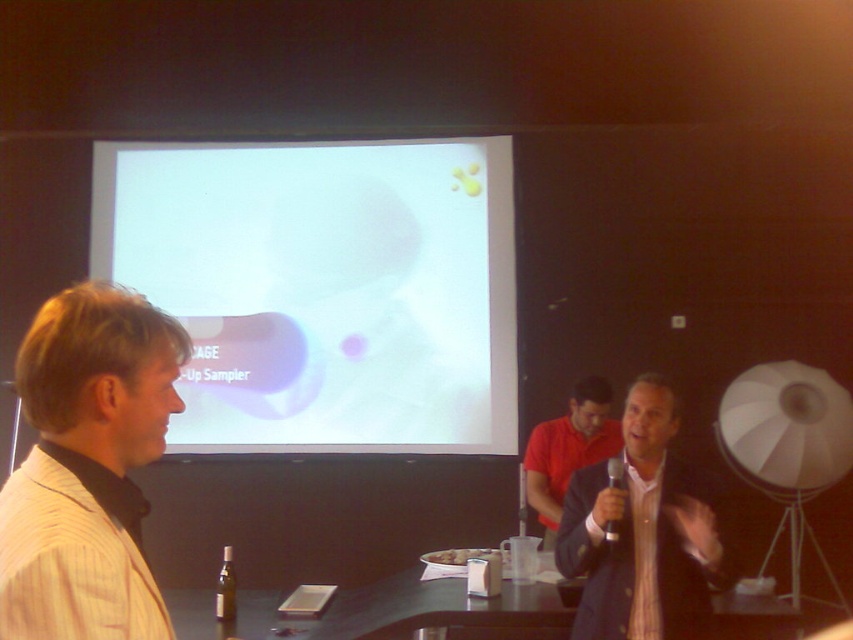
This screenshot has height=640, width=853. Describe the element at coordinates (323, 289) in the screenshot. I see `white glossy projection screen at upper center` at that location.

Based on the photo, can you confirm if white glossy projection screen at upper center is taller than light beige striped shirt at left?

Yes, white glossy projection screen at upper center is taller than light beige striped shirt at left.

Who is more distant from viewer, (415, 416) or (119, 301)?

Positioned behind is point (415, 416).

Image resolution: width=853 pixels, height=640 pixels. I want to click on white glossy projection screen at upper center, so click(323, 289).

Is the position of matte black suit at center more distant than that of red matte shirt at center?

No.

Between matte black suit at center and red matte shirt at center, which one is positioned lower?

red matte shirt at center is lower down.

Between point (604, 508) and point (614, 426), which one is positioned in front?

Positioned in front is point (604, 508).

You are a GUI agent. You are given a task and a screenshot of the screen. Output one action in this format:
    pyautogui.click(x=<x>, y=<y>)
    Task: Click on the matte black suit at center
    
    Given the screenshot: What is the action you would take?
    pyautogui.click(x=641, y=532)

Between white glossy projection screen at upper center and matte black suit at center, which one is positioned lower?

matte black suit at center

Can you confirm if white glossy projection screen at upper center is positioned to the right of matte black suit at center?

In fact, white glossy projection screen at upper center is to the left of matte black suit at center.

Describe the element at coordinates (323, 289) in the screenshot. The image size is (853, 640). I see `white glossy projection screen at upper center` at that location.

I want to click on white glossy projection screen at upper center, so click(323, 289).